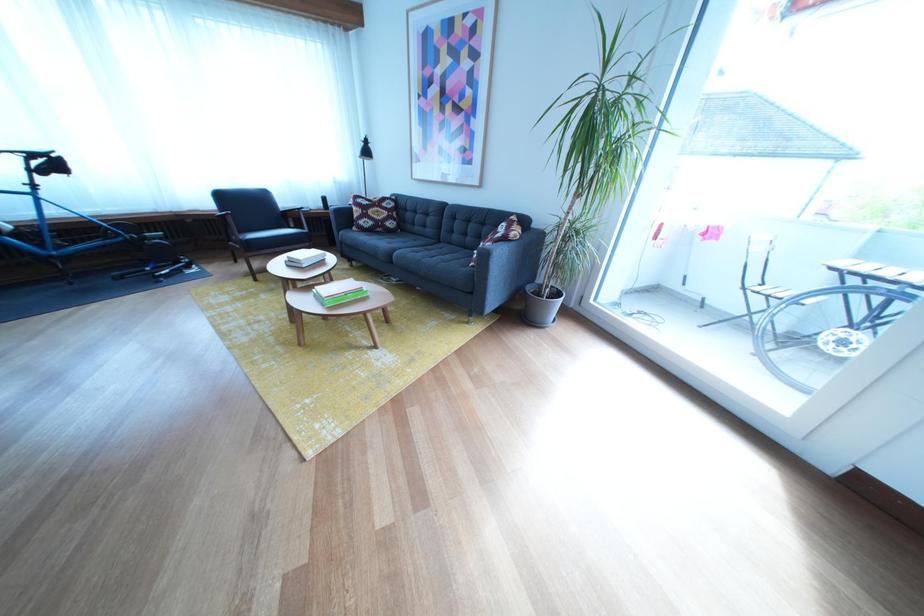
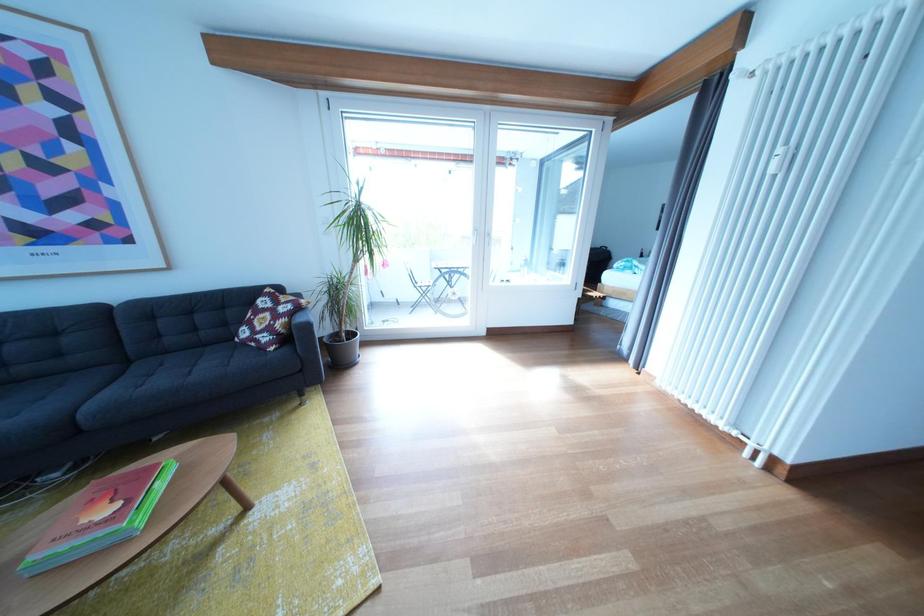
The point at (591, 201) is marked in the first image. Where is the corresponding point in the second image?

(370, 267)